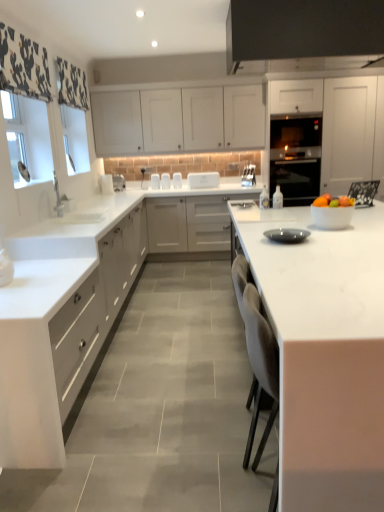
Question: Is white matte cabinet at left, the first cabinetry positioned from the left, surrounding white matte cabinet at upper center, the second cabinetry when ordered from left to right?

Choices:
 (A) no
 (B) yes

Answer: (A)

Question: From the image's perspective, would you say white matte cabinet at left, the first cabinetry positioned from the left, is positioned over white matte cabinet at upper center, placed as the third cabinetry when sorted from right to left?

Choices:
 (A) no
 (B) yes

Answer: (A)

Question: From a real-world perspective, is white matte cabinet at left, the first cabinetry positioned from the left, located beneath white matte cabinet at upper center, placed as the third cabinetry when sorted from right to left?

Choices:
 (A) yes
 (B) no

Answer: (A)

Question: Can you confirm if white matte cabinet at left, the first cabinetry positioned from the left, is taller than white matte cabinet at upper center, placed as the third cabinetry when sorted from right to left?

Choices:
 (A) yes
 (B) no

Answer: (A)

Question: Can you confirm if white matte cabinet at left, the fourth cabinetry in the right-to-left sequence, is positioned to the right of white matte cabinet at upper center, placed as the third cabinetry when sorted from right to left?

Choices:
 (A) yes
 (B) no

Answer: (B)

Question: From the image's perspective, relative to matte gray plate at center, marked as the second appliance in a top-to-bottom arrangement, is white marble countertop at center, acting as the 2th countertop starting from the right, above or below?

Choices:
 (A) above
 (B) below

Answer: (B)

Question: Is white marble countertop at center, acting as the 2th countertop starting from the right, inside the boundaries of matte gray plate at center, positioned as the second appliance in back-to-front order, or outside?

Choices:
 (A) inside
 (B) outside

Answer: (B)

Question: Visually, is white marble countertop at center, acting as the first countertop starting from the left, positioned to the left or to the right of matte gray plate at center, which is the first appliance from front to back?

Choices:
 (A) right
 (B) left

Answer: (B)

Question: From their relative heights in the image, would you say white marble countertop at center, acting as the first countertop starting from the left, is taller or shorter than matte gray plate at center, the 1th appliance positioned from the bottom?

Choices:
 (A) short
 (B) tall

Answer: (B)

Question: Would you say white matte cabinet at right, placed as the first cabinetry when sorted from right to left, is to the left or to the right of white marble countertop at center, acting as the first countertop starting from the left, in the picture?

Choices:
 (A) left
 (B) right

Answer: (B)

Question: From a real-world perspective, is white matte cabinet at right, the fourth cabinetry positioned from the left, physically located above or below white marble countertop at center, acting as the first countertop starting from the left?

Choices:
 (A) below
 (B) above

Answer: (B)

Question: Does point (314, 125) appear closer or farther from the camera than point (36, 289)?

Choices:
 (A) closer
 (B) farther

Answer: (B)

Question: Considering the positions of white matte cabinet at right, placed as the first cabinetry when sorted from right to left, and white marble countertop at center, acting as the first countertop starting from the left, in the image, is white matte cabinet at right, placed as the first cabinetry when sorted from right to left, wider or thinner than white marble countertop at center, acting as the first countertop starting from the left,?

Choices:
 (A) wide
 (B) thin

Answer: (B)

Question: Visually, is white glossy bowl at right positioned to the left or to the right of black glass oven at center?

Choices:
 (A) left
 (B) right

Answer: (A)

Question: Does point (322, 212) appear closer or farther from the camera than point (278, 157)?

Choices:
 (A) farther
 (B) closer

Answer: (B)